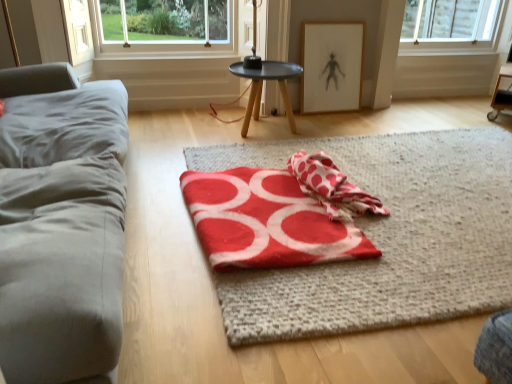
Image resolution: width=512 pixels, height=384 pixels. I want to click on vacant area located to the right-hand side of matte black table at center, so click(323, 128).